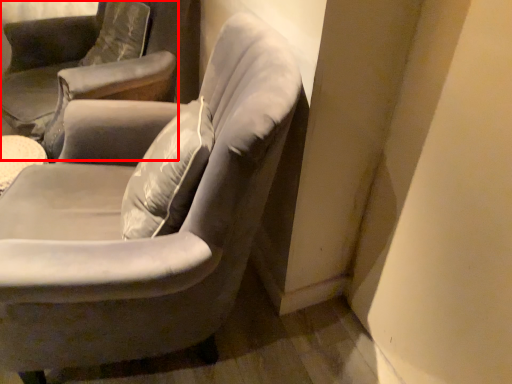
Question: From the image's perspective, what is the correct spatial positioning of chair (annotated by the red box) in reference to chair?

Choices:
 (A) below
 (B) above

Answer: (B)